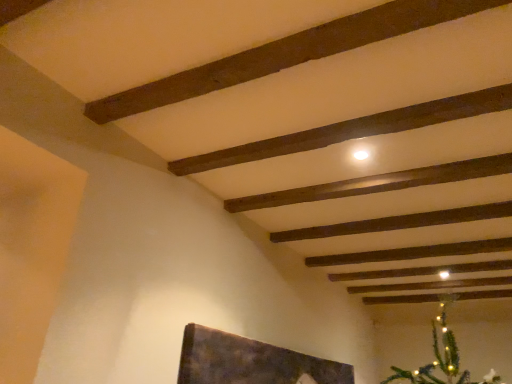
Question: Is dark brown wood plank at upper center, which is the 2th plank in top-to-bottom order, positioned with its back to dark brown wood plank at upper center, placed as the third plank when sorted from bottom to top?

Choices:
 (A) no
 (B) yes

Answer: (B)

Question: Can you confirm if dark brown wood plank at upper center, which is the 2th plank in top-to-bottom order, is shorter than dark brown wood plank at upper center, which ranks as the first plank in top-to-bottom order?

Choices:
 (A) no
 (B) yes

Answer: (B)

Question: Is dark brown wood plank at upper center, which is the 2th plank in top-to-bottom order, taller than dark brown wood plank at upper center, which ranks as the first plank in top-to-bottom order?

Choices:
 (A) no
 (B) yes

Answer: (A)

Question: From the image's perspective, would you say dark brown wood plank at upper center, which is the 2th plank in top-to-bottom order, is shown under dark brown wood plank at upper center, placed as the third plank when sorted from bottom to top?

Choices:
 (A) no
 (B) yes

Answer: (B)

Question: Is dark brown wood plank at upper center, placed as the second plank when sorted from bottom to top, to the left of dark brown wood plank at upper center, placed as the third plank when sorted from bottom to top, from the viewer's perspective?

Choices:
 (A) yes
 (B) no

Answer: (B)

Question: Considering the relative sizes of dark brown wood plank at upper center, which is the 2th plank in top-to-bottom order, and dark brown wood plank at upper center, which ranks as the first plank in top-to-bottom order, in the image provided, is dark brown wood plank at upper center, which is the 2th plank in top-to-bottom order, thinner than dark brown wood plank at upper center, which ranks as the first plank in top-to-bottom order,?

Choices:
 (A) no
 (B) yes

Answer: (B)

Question: Considering the relative sizes of dark brown wood plank at upper center, placed as the third plank when sorted from bottom to top, and smooth wooden plank at center, arranged as the first plank when ordered from the bottom, in the image provided, is dark brown wood plank at upper center, placed as the third plank when sorted from bottom to top, smaller than smooth wooden plank at center, arranged as the first plank when ordered from the bottom,?

Choices:
 (A) yes
 (B) no

Answer: (B)

Question: From the image's perspective, does dark brown wood plank at upper center, placed as the third plank when sorted from bottom to top, appear higher than smooth wooden plank at center, marked as the third plank in a top-to-bottom arrangement?

Choices:
 (A) yes
 (B) no

Answer: (A)

Question: Are dark brown wood plank at upper center, which ranks as the first plank in top-to-bottom order, and smooth wooden plank at center, marked as the third plank in a top-to-bottom arrangement, located far from each other?

Choices:
 (A) no
 (B) yes

Answer: (A)

Question: Does dark brown wood plank at upper center, placed as the third plank when sorted from bottom to top, touch smooth wooden plank at center, arranged as the first plank when ordered from the bottom?

Choices:
 (A) no
 (B) yes

Answer: (A)

Question: Is dark brown wood plank at upper center, placed as the third plank when sorted from bottom to top, taller than smooth wooden plank at center, marked as the third plank in a top-to-bottom arrangement?

Choices:
 (A) yes
 (B) no

Answer: (A)

Question: Is dark brown wood plank at upper center, which ranks as the first plank in top-to-bottom order, wider than smooth wooden plank at center, marked as the third plank in a top-to-bottom arrangement?

Choices:
 (A) yes
 (B) no

Answer: (A)

Question: Is smooth wooden plank at center, marked as the third plank in a top-to-bottom arrangement, far from dark brown wood plank at upper center, which is the 2th plank in top-to-bottom order?

Choices:
 (A) no
 (B) yes

Answer: (A)